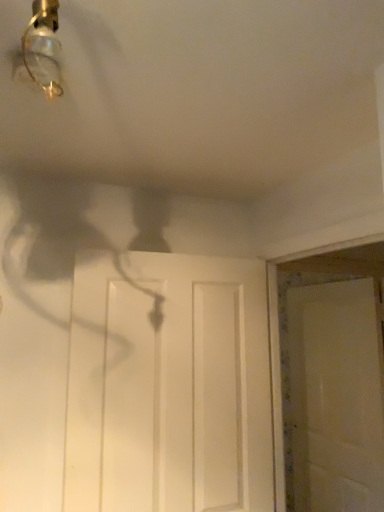
Question: Which is correct: white matte door at center, the 1th door in the back-to-front sequence, is inside white matte door at center, acting as the 1th door starting from the left, or outside of it?

Choices:
 (A) outside
 (B) inside

Answer: (A)

Question: Considering their positions, is white matte door at center, arranged as the second door when viewed from the front, located in front of or behind white matte door at center, the first door viewed from the front?

Choices:
 (A) behind
 (B) front

Answer: (A)

Question: Is white matte door at center, the 1th door in the back-to-front sequence, bigger or smaller than white matte door at center, the second door positioned from the right?

Choices:
 (A) small
 (B) big

Answer: (A)

Question: In terms of height, does white matte door at center, acting as the 1th door starting from the left, look taller or shorter compared to white matte door at center, which ranks as the second door in left-to-right order?

Choices:
 (A) tall
 (B) short

Answer: (B)

Question: From the image's perspective, relative to white matte door at center, which ranks as the second door in left-to-right order, is white matte door at center, the second door positioned from the right, above or below?

Choices:
 (A) above
 (B) below

Answer: (A)

Question: Considering the positions of point (148, 256) and point (312, 301), is point (148, 256) closer or farther from the camera than point (312, 301)?

Choices:
 (A) closer
 (B) farther

Answer: (A)

Question: Considering the positions of white matte door at center, acting as the 1th door starting from the left, and white matte door at center, which is the first door from right to left, in the image, is white matte door at center, acting as the 1th door starting from the left, bigger or smaller than white matte door at center, which is the first door from right to left,?

Choices:
 (A) small
 (B) big

Answer: (B)